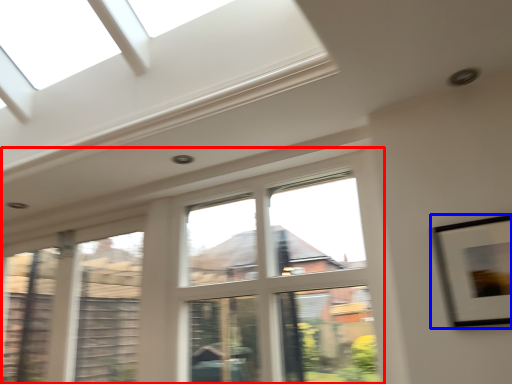
Question: Which object is further to the camera taking this photo, window (highlighted by a red box) or picture frame (highlighted by a blue box)?

Choices:
 (A) window
 (B) picture frame

Answer: (A)